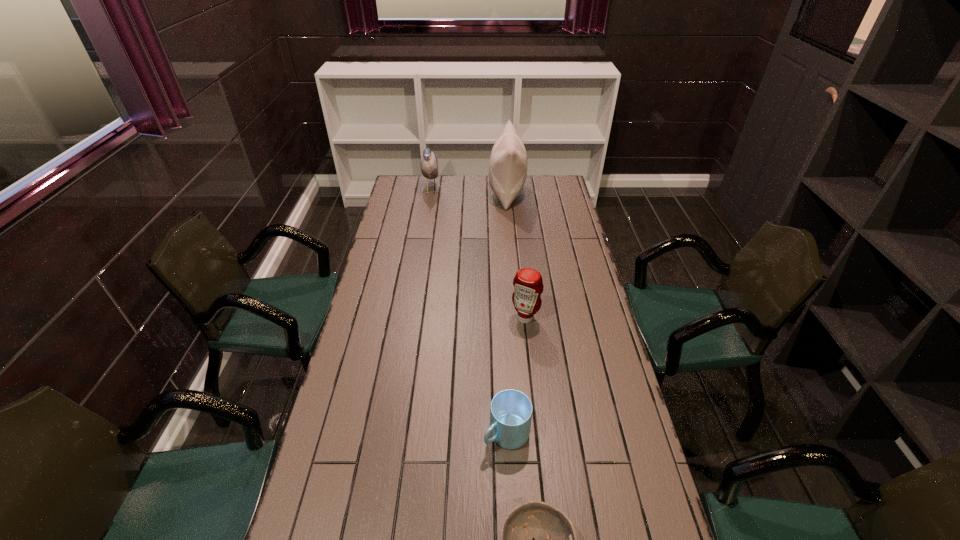
Locate an element on the screen. blank space that satisfies the following two spatial constraints: 1. at the tip of the leftmost object's beak; 2. on the right side of the condiment is located at coordinates (410, 318).

At what (x,y) coordinates should I click in order to perform the action: click on blank space that satisfies the following two spatial constraints: 1. on the front side of the cushion; 2. on the front side of the second nearest object. Please return your answer as a coordinate pair (x, y). The height and width of the screenshot is (540, 960). Looking at the image, I should click on (528, 434).

I want to click on vacant space that satisfies the following two spatial constraints: 1. on the front side of the third nearest object; 2. on the right side of the tallest object, so click(517, 318).

Locate an element on the screen. This screenshot has height=540, width=960. vacant area in the image that satisfies the following two spatial constraints: 1. on the front side of the condiment; 2. on the right side of the cushion is located at coordinates (517, 318).